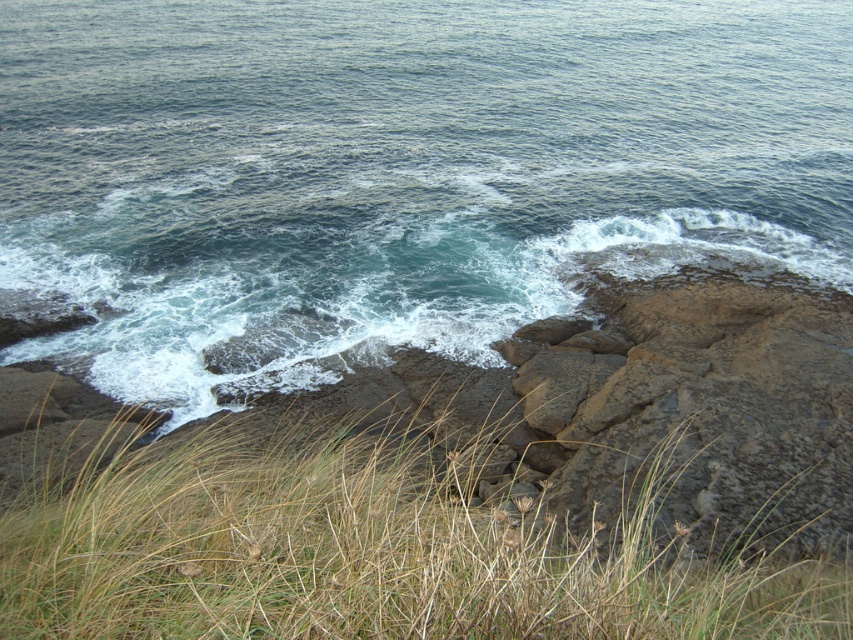
Question: Does blue water at center lie in front of brown grass at lower center?

Choices:
 (A) yes
 (B) no

Answer: (B)

Question: Which point appears closest to the camera in this image?

Choices:
 (A) (717, 598)
 (B) (764, 218)

Answer: (A)

Question: Is the position of blue water at center more distant than that of brown grass at lower center?

Choices:
 (A) no
 (B) yes

Answer: (B)

Question: Observing the image, what is the correct spatial positioning of blue water at center in reference to brown grass at lower center?

Choices:
 (A) below
 (B) above

Answer: (B)

Question: Which of the following is the farthest from the observer?

Choices:
 (A) brown grass at lower center
 (B) blue water at center

Answer: (B)